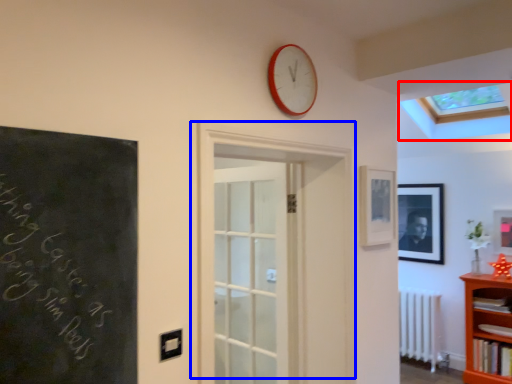
Question: Which point is further to the camera, window (highlighted by a red box) or door (highlighted by a blue box)?

Choices:
 (A) window
 (B) door

Answer: (A)